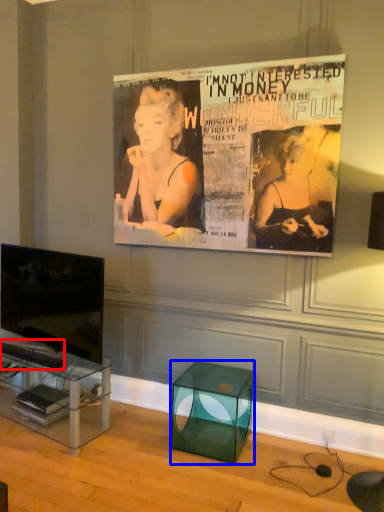
Question: Which object appears farthest to the camera in this image, magazine (highlighted by a red box) or glass box (highlighted by a blue box)?

Choices:
 (A) magazine
 (B) glass box

Answer: (A)